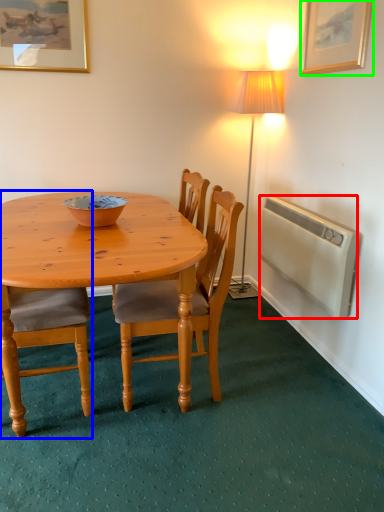
Question: Which object is positioned farthest from radiator (highlighted by a red box)? Select from chair (highlighted by a blue box) and picture frame (highlighted by a green box).

Choices:
 (A) chair
 (B) picture frame

Answer: (A)